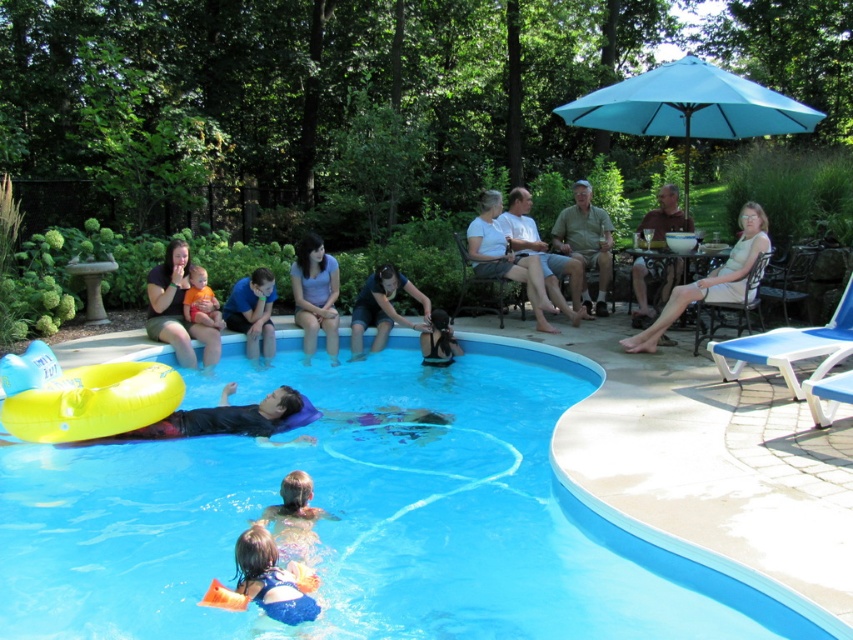
Is dark blue denim shorts at center smaller than brown fabric chair at upper right?

No.

Is dark blue denim shorts at center in front of brown fabric chair at upper right?

That is True.

Locate an element on the screen. dark blue denim shorts at center is located at coordinates (383, 308).

Is blue fabric umbrella at upper right to the left of matte blue shorts at center from the viewer's perspective?

Incorrect, blue fabric umbrella at upper right is not on the left side of matte blue shorts at center.

Between blue fabric umbrella at upper right and matte blue shorts at center, which one has less height?

With less height is matte blue shorts at center.

Who is more distant from viewer, (698, 61) or (650, 225)?

Point (650, 225)

Locate an element on the screen. blue fabric umbrella at upper right is located at coordinates (689, 108).

Between point (361, 292) and point (289, 518), which one is positioned in front?

Point (289, 518)

Is point (387, 330) positioned after point (280, 492)?

Yes, it is.

Between point (383, 298) and point (305, 536), which one is positioned behind?

The point (383, 298) is more distant.

At what (x,y) coordinates should I click in order to perform the action: click on dark blue denim shorts at center. Please return your answer as a coordinate pair (x, y). Looking at the image, I should click on click(383, 308).